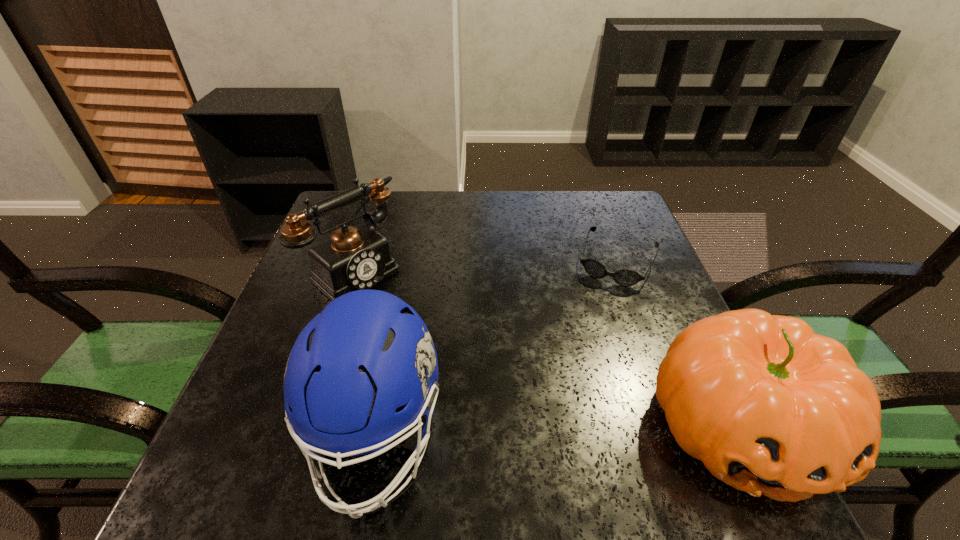
Find the location of a particular element. vacant space at the far left corner of the desktop is located at coordinates (371, 207).

Where is `vacant space at the near left corner of the desktop`? vacant space at the near left corner of the desktop is located at coordinates (271, 434).

This screenshot has width=960, height=540. Identify the location of blank space at the far right corner of the desktop. (630, 222).

The height and width of the screenshot is (540, 960). In order to click on vacant space at the near right corner in this screenshot , I will do `click(647, 419)`.

You are a GUI agent. You are given a task and a screenshot of the screen. Output one action in this format:
    pyautogui.click(x=<x>, y=<y>)
    Task: Click on the free space between the sunglasses and the football helmet
    
    Given the screenshot: What is the action you would take?
    pyautogui.click(x=496, y=348)

At what (x,y) coordinates should I click in order to perform the action: click on vacant space in between the sunglasses and the telephone. Please return your answer as a coordinate pair (x, y). Looking at the image, I should click on [x=487, y=266].

This screenshot has width=960, height=540. I want to click on vacant point located between the telephone and the sunglasses, so click(487, 266).

At what (x,y) coordinates should I click in order to perform the action: click on free area in between the telephone and the sunglasses. Please return your answer as a coordinate pair (x, y). Looking at the image, I should click on (487, 266).

Identify the location of free space between the telephone and the pumpkin. Image resolution: width=960 pixels, height=540 pixels. (548, 348).

You are a GUI agent. You are given a task and a screenshot of the screen. Output one action in this format:
    pyautogui.click(x=<x>, y=<y>)
    Task: Click on the free space that is in between the telephone and the shortest object
    
    Given the screenshot: What is the action you would take?
    pyautogui.click(x=487, y=266)